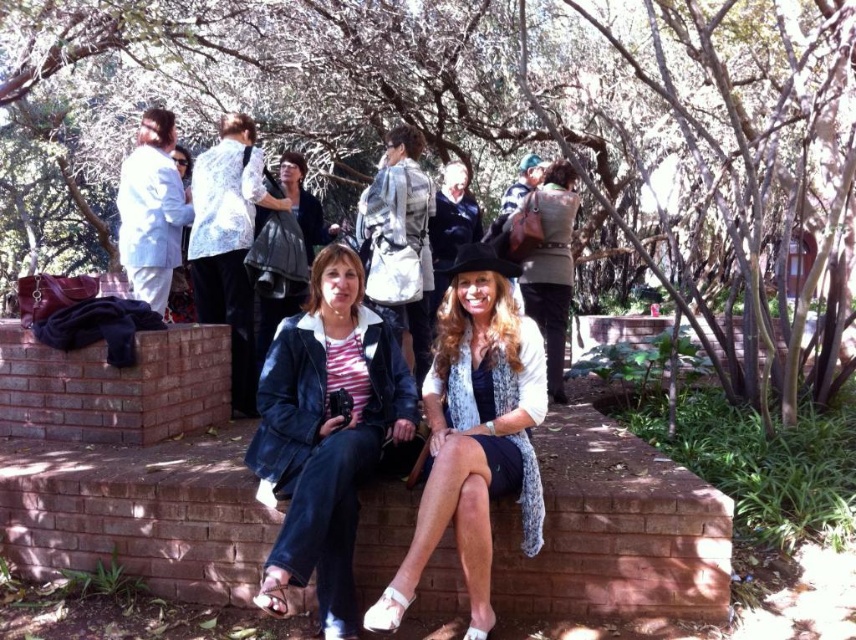
Can you confirm if matte black hat at center is thinner than dark gray fabric jacket at upper center?

No.

Between point (479, 280) and point (325, 234), which one is positioned behind?

The point (325, 234) is more distant.

Describe the element at coordinates (474, 435) in the screenshot. I see `matte black hat at center` at that location.

Image resolution: width=856 pixels, height=640 pixels. Identify the location of matte black hat at center. (474, 435).

Is green leafy tree at center to the left of dark gray fabric jacket at upper center from the viewer's perspective?

Correct, you'll find green leafy tree at center to the left of dark gray fabric jacket at upper center.

Is green leafy tree at center above dark gray fabric jacket at upper center?

Yes.

This screenshot has width=856, height=640. What do you see at coordinates (480, 129) in the screenshot?
I see `green leafy tree at center` at bounding box center [480, 129].

Where is `green leafy tree at center`? green leafy tree at center is located at coordinates (480, 129).

Which is more to the left, green leafy tree at center or matte black hat at center?

Positioned to the left is green leafy tree at center.

Who is more forward, (x=693, y=216) or (x=462, y=483)?

Positioned in front is point (x=462, y=483).

Find the location of a particular element. This screenshot has height=640, width=856. green leafy tree at center is located at coordinates (480, 129).